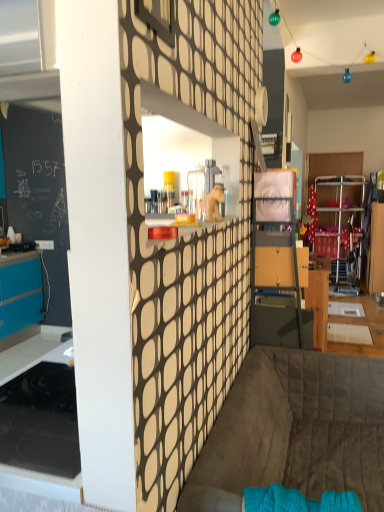
Question: Are matte glass window at upper center and wooden drawer at center far apart?

Choices:
 (A) yes
 (B) no

Answer: (A)

Question: Is matte glass window at upper center outside wooden drawer at center?

Choices:
 (A) yes
 (B) no

Answer: (A)

Question: From the image's perspective, would you say matte glass window at upper center is positioned over wooden drawer at center?

Choices:
 (A) yes
 (B) no

Answer: (A)

Question: Is matte glass window at upper center looking in the opposite direction of wooden drawer at center?

Choices:
 (A) yes
 (B) no

Answer: (B)

Question: Is the position of matte glass window at upper center more distant than that of wooden drawer at center?

Choices:
 (A) no
 (B) yes

Answer: (A)

Question: Is point (264, 381) closer or farther from the camera than point (302, 266)?

Choices:
 (A) closer
 (B) farther

Answer: (A)

Question: Considering the positions of dark gray quilted couch at lower center and wooden drawer at center in the image, is dark gray quilted couch at lower center taller or shorter than wooden drawer at center?

Choices:
 (A) tall
 (B) short

Answer: (A)

Question: Is dark gray quilted couch at lower center in front of or behind wooden drawer at center in the image?

Choices:
 (A) front
 (B) behind

Answer: (A)

Question: From a real-world perspective, is dark gray quilted couch at lower center positioned above or below wooden drawer at center?

Choices:
 (A) above
 (B) below

Answer: (B)

Question: From a real-world perspective, is matte glass window at upper center positioned above or below dark gray quilted couch at lower center?

Choices:
 (A) below
 (B) above

Answer: (B)

Question: Based on their positions, is matte glass window at upper center located to the left or right of dark gray quilted couch at lower center?

Choices:
 (A) left
 (B) right

Answer: (A)

Question: In the image, is matte glass window at upper center positioned in front of or behind dark gray quilted couch at lower center?

Choices:
 (A) front
 (B) behind

Answer: (A)

Question: From the image's perspective, relative to dark gray quilted couch at lower center, is matte glass window at upper center above or below?

Choices:
 (A) above
 (B) below

Answer: (A)

Question: Which is correct: dark gray quilted couch at lower center is inside matte glass window at upper center, or outside of it?

Choices:
 (A) outside
 (B) inside

Answer: (A)

Question: Is point (221, 461) positioned closer to the camera than point (158, 19)?

Choices:
 (A) closer
 (B) farther

Answer: (B)